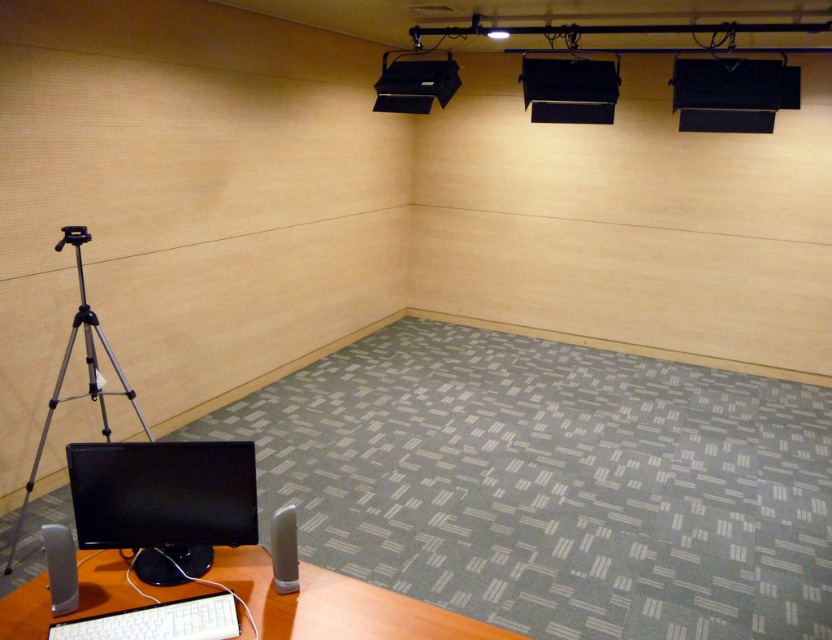
You are setting up a presentation in this recording room and need to know if the black matte projector at upper center can fit on the desk where the gray matte speaker at lower left is currently placed. Can it fit?

The black matte projector at upper center is wider than the gray matte speaker at lower left. Therefore, it may not fit on the desk space currently occupied by the gray matte speaker at lower left unless there is additional room available.

Looking at this image, you are setting up a recording session and need to adjust the position of the white plastic keyboard at lower center and the white glossy speaker at lower center. Based on their current positions, which object is closer to you?

The white plastic keyboard at lower center is closer to you because it is in front of the white glossy speaker at lower center.